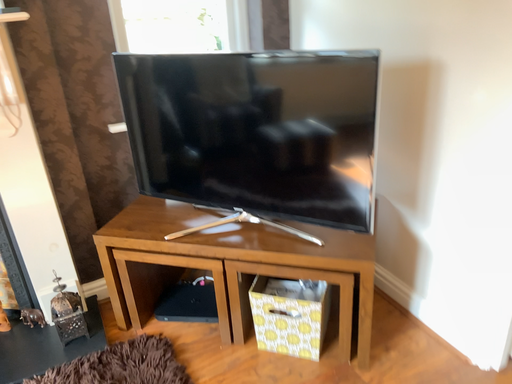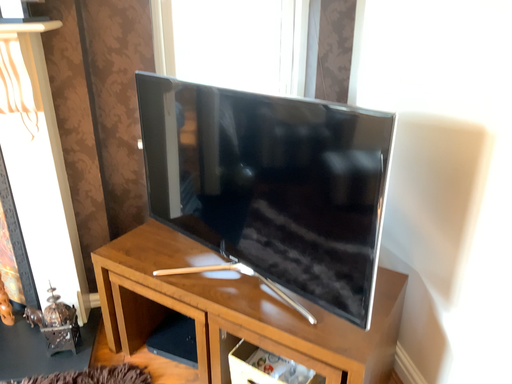
Question: Which way did the camera rotate in the video?

Choices:
 (A) rotated right
 (B) rotated left

Answer: (B)